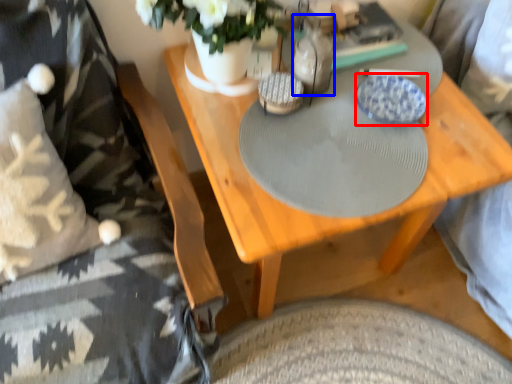
Question: Among these objects, which one is farthest to the camera, plate (highlighted by a red box) or bottle (highlighted by a blue box)?

Choices:
 (A) plate
 (B) bottle

Answer: (A)